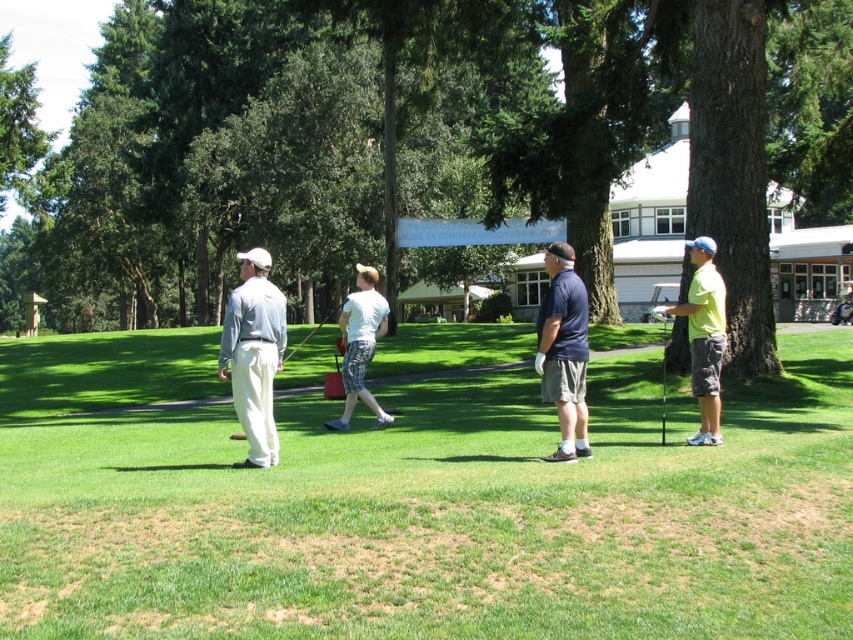
Question: Does green grass at center lie behind light gray cotton pants at left?

Choices:
 (A) no
 (B) yes

Answer: (A)

Question: Which point is closer to the camera taking this photo?

Choices:
 (A) [358, 284]
 (B) [672, 208]

Answer: (A)

Question: Based on their relative distances, which object is farther from the green grass at center?

Choices:
 (A) matte black golf club at center
 (B) metallic silver golf club at right
 (C) dark brown bark tree at right

Answer: (A)

Question: Which point is farther to the camera?

Choices:
 (A) white cotton shirt at center
 (B) dark brown bark tree at right
 (C) light gray cotton pants at left

Answer: (B)

Question: Does dark brown bark tree at right lie in front of light gray cotton pants at left?

Choices:
 (A) no
 (B) yes

Answer: (A)

Question: Considering the relative positions of dark brown bark tree at right and light gray cotton pants at left in the image provided, where is dark brown bark tree at right located with respect to light gray cotton pants at left?

Choices:
 (A) left
 (B) right

Answer: (B)